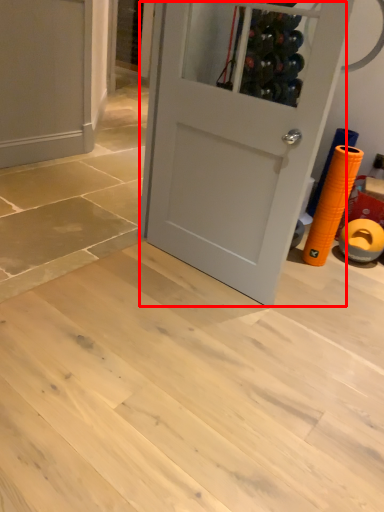
Question: Observing the image, what is the correct spatial positioning of door (annotated by the red box) in reference to door?

Choices:
 (A) left
 (B) right

Answer: (B)